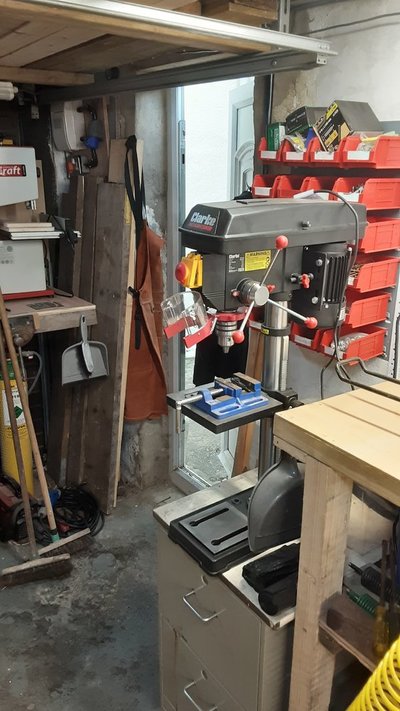
Identify the location of file cabinet. (249, 640).